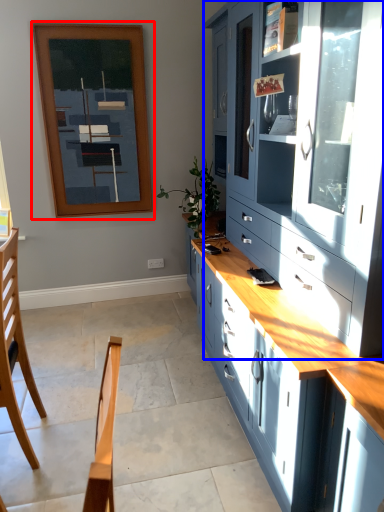
Question: Which object appears farthest to the camera in this image, picture frame (highlighted by a red box) or cabinetry (highlighted by a blue box)?

Choices:
 (A) picture frame
 (B) cabinetry

Answer: (A)